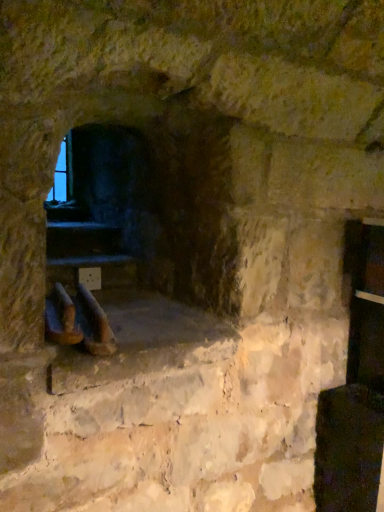
Question: Considering the relative positions of brown leather boot at lower left, the 1th footwear when ordered from left to right, and brown leather boot at center, the 1th footwear in the right-to-left sequence, in the image provided, is brown leather boot at lower left, the 1th footwear when ordered from left to right, to the right of brown leather boot at center, the 1th footwear in the right-to-left sequence, from the viewer's perspective?

Choices:
 (A) yes
 (B) no

Answer: (B)

Question: From the image's perspective, does brown leather boot at lower left, the 1th footwear when ordered from left to right, appear lower than brown leather boot at center, which is the second footwear from left to right?

Choices:
 (A) yes
 (B) no

Answer: (B)

Question: Is brown leather boot at lower left, the 1th footwear when ordered from left to right, facing towards brown leather boot at center, the 1th footwear in the right-to-left sequence?

Choices:
 (A) yes
 (B) no

Answer: (B)

Question: Can you confirm if brown leather boot at lower left, the 1th footwear when ordered from left to right, is bigger than brown leather boot at center, the 1th footwear in the right-to-left sequence?

Choices:
 (A) no
 (B) yes

Answer: (A)

Question: Is brown leather boot at lower left, marked as the second footwear in a right-to-left arrangement, positioned far away from brown leather boot at center, which is the second footwear from left to right?

Choices:
 (A) no
 (B) yes

Answer: (A)

Question: Considering the positions of point (x=62, y=320) and point (x=91, y=306), is point (x=62, y=320) closer or farther from the camera than point (x=91, y=306)?

Choices:
 (A) farther
 (B) closer

Answer: (B)

Question: Considering their positions, is brown leather boot at lower left, the 1th footwear when ordered from left to right, located in front of or behind brown leather boot at center, the 1th footwear in the right-to-left sequence?

Choices:
 (A) front
 (B) behind

Answer: (A)

Question: From the image's perspective, is brown leather boot at lower left, marked as the second footwear in a right-to-left arrangement, positioned above or below brown leather boot at center, which is the second footwear from left to right?

Choices:
 (A) above
 (B) below

Answer: (A)

Question: Is brown leather boot at lower left, the 1th footwear when ordered from left to right, bigger or smaller than brown leather boot at center, which is the second footwear from left to right?

Choices:
 (A) big
 (B) small

Answer: (B)

Question: From a real-world perspective, is brown leather boot at lower left, marked as the second footwear in a right-to-left arrangement, above or below dark stone fireplace at center?

Choices:
 (A) below
 (B) above

Answer: (A)

Question: Is brown leather boot at lower left, the 1th footwear when ordered from left to right, in front of or behind dark stone fireplace at center in the image?

Choices:
 (A) front
 (B) behind

Answer: (A)

Question: Considering the positions of brown leather boot at lower left, the 1th footwear when ordered from left to right, and dark stone fireplace at center in the image, is brown leather boot at lower left, the 1th footwear when ordered from left to right, bigger or smaller than dark stone fireplace at center?

Choices:
 (A) big
 (B) small

Answer: (B)

Question: Is brown leather boot at lower left, marked as the second footwear in a right-to-left arrangement, inside or outside of dark stone fireplace at center?

Choices:
 (A) inside
 (B) outside

Answer: (B)

Question: Is brown leather boot at center, the 1th footwear in the right-to-left sequence, in front of or behind dark stone fireplace at center in the image?

Choices:
 (A) front
 (B) behind

Answer: (A)

Question: From the image's perspective, is brown leather boot at center, which is the second footwear from left to right, located above or below dark stone fireplace at center?

Choices:
 (A) above
 (B) below

Answer: (B)